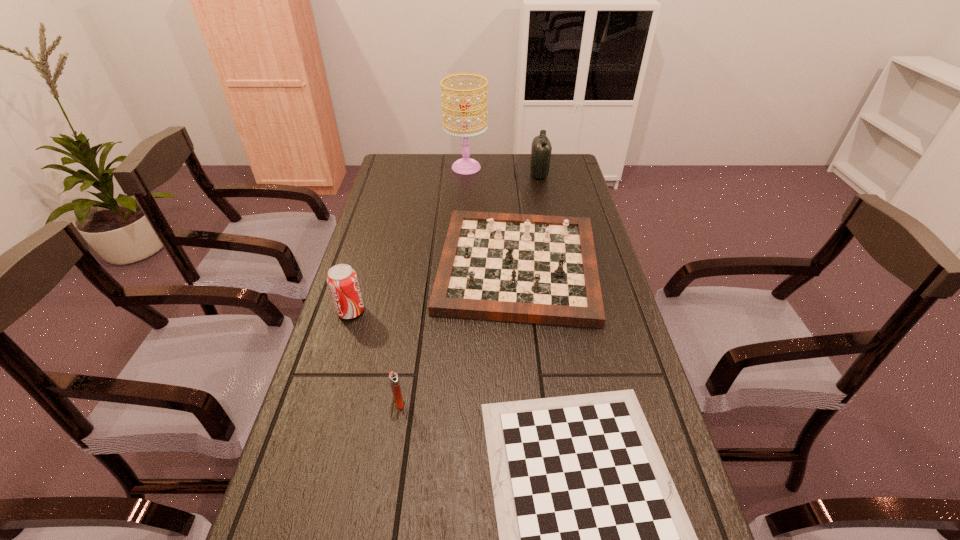
I want to click on the tallest object, so click(x=466, y=165).

Where is `bottle`? bottle is located at coordinates point(541,148).

This screenshot has width=960, height=540. I want to click on the fourth shortest object, so click(x=342, y=280).

What are the coordinates of `soda can` in the screenshot? It's located at (342, 280).

The width and height of the screenshot is (960, 540). Identify the location of the fifth object from right to left. (393, 377).

The image size is (960, 540). What are the coordinates of `the taller chessboard` in the screenshot? It's located at (542, 269).

The width and height of the screenshot is (960, 540). What are the coordinates of `blank space located 0.100m on the front of the lampshade` in the screenshot? It's located at (465, 192).

The image size is (960, 540). What are the coordinates of `vacant area situated 0.120m on the right of the bottle` in the screenshot? It's located at (579, 174).

You are a GUI agent. You are given a task and a screenshot of the screen. Output one action in this format:
    pyautogui.click(x=<x>, y=<y>)
    Task: Click on the free space located on the logo side of the soda can
    This screenshot has height=540, width=960.
    Given the screenshot: What is the action you would take?
    pyautogui.click(x=453, y=311)

The width and height of the screenshot is (960, 540). Find the location of `free space located 0.240m on the front of the igniter`. free space located 0.240m on the front of the igniter is located at coordinates (379, 527).